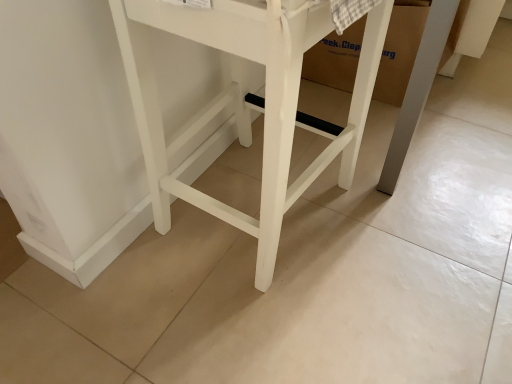
Where is `free space in front of white matte stool at center`? The width and height of the screenshot is (512, 384). free space in front of white matte stool at center is located at coordinates (264, 328).